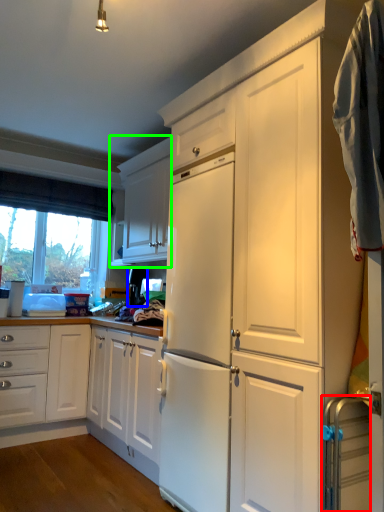
Question: Which object is positioned farthest from appliance (highlighted by a red box)? Select from appliance (highlighted by a blue box) and cabinetry (highlighted by a green box).

Choices:
 (A) appliance
 (B) cabinetry

Answer: (B)